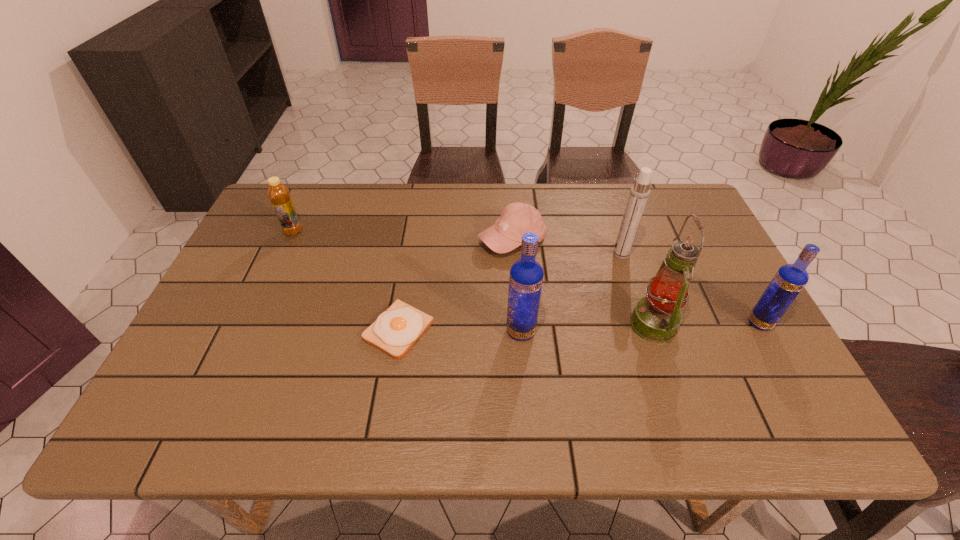
Locate an element on the screen. The width and height of the screenshot is (960, 540). blank area in the image that satisfies the following two spatial constraints: 1. on the back side of the toast; 2. on the left side of the right vodka is located at coordinates (400, 323).